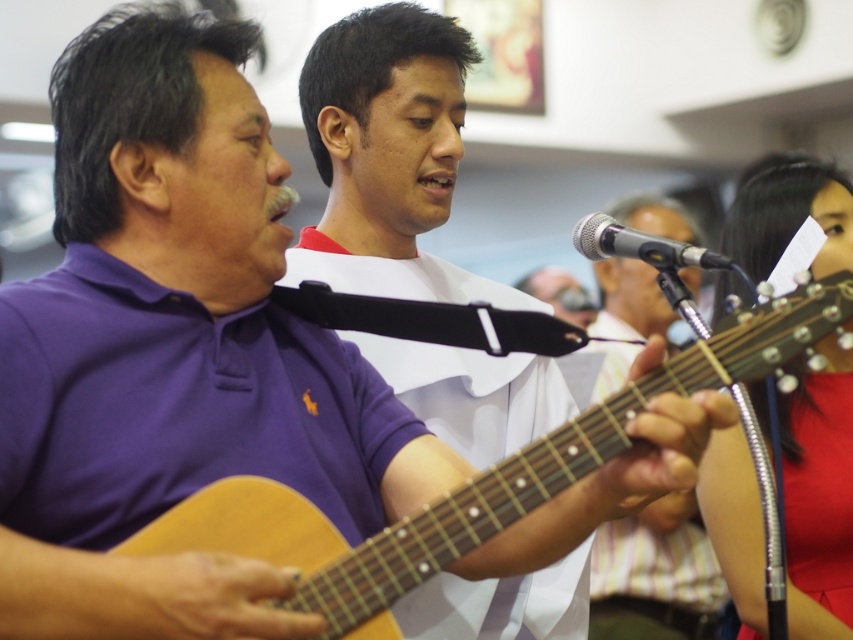
Does light brown acoustic guitar at left appear under silver metallic microphone at center?

Yes, light brown acoustic guitar at left is below silver metallic microphone at center.

Is light brown acoustic guitar at left further to the viewer compared to silver metallic microphone at center?

That is False.

Is point (192, 512) positioned after point (662, 257)?

No, it is not.

At what (x,y) coordinates should I click in order to perform the action: click on light brown acoustic guitar at left. Please return your answer as a coordinate pair (x, y). The image size is (853, 640). Looking at the image, I should click on (469, 481).

Consider the image. Can you confirm if matte purple polo shirt at center is positioned above light brown acoustic guitar at left?

Indeed, matte purple polo shirt at center is positioned over light brown acoustic guitar at left.

Can you confirm if matte purple polo shirt at center is positioned below light brown acoustic guitar at left?

No, matte purple polo shirt at center is not below light brown acoustic guitar at left.

What do you see at coordinates (387, 156) in the screenshot?
I see `matte purple polo shirt at center` at bounding box center [387, 156].

I want to click on matte purple polo shirt at center, so click(x=387, y=156).

Does matte purple polo shirt at center come in front of silver metallic microphone at center?

Yes, it is.

What do you see at coordinates (387, 156) in the screenshot?
I see `matte purple polo shirt at center` at bounding box center [387, 156].

Does point (345, 173) come closer to viewer compared to point (717, 252)?

Yes, it is.

Image resolution: width=853 pixels, height=640 pixels. I want to click on matte purple polo shirt at center, so click(387, 156).